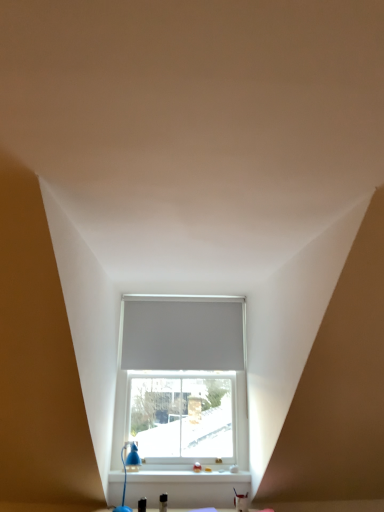
Question: Can you confirm if white matte window at center is wider than white plastic window sill at lower center?

Choices:
 (A) yes
 (B) no

Answer: (B)

Question: Does white matte window at center appear on the left side of white plastic window sill at lower center?

Choices:
 (A) no
 (B) yes

Answer: (A)

Question: Considering the relative sizes of white matte window at center and white plastic window sill at lower center in the image provided, is white matte window at center smaller than white plastic window sill at lower center?

Choices:
 (A) no
 (B) yes

Answer: (A)

Question: From a real-world perspective, is white matte window at center physically below white plastic window sill at lower center?

Choices:
 (A) yes
 (B) no

Answer: (B)

Question: Would you consider white matte window at center to be distant from white plastic window sill at lower center?

Choices:
 (A) no
 (B) yes

Answer: (A)

Question: From the image's perspective, relative to white plastic window sill at lower center, is white matte window at center above or below?

Choices:
 (A) below
 (B) above

Answer: (B)

Question: Is point (218, 442) positioned closer to the camera than point (157, 480)?

Choices:
 (A) closer
 (B) farther

Answer: (B)

Question: Relative to white plastic window sill at lower center, is white matte window at center in front or behind?

Choices:
 (A) front
 (B) behind

Answer: (B)

Question: Is white matte window at center inside the boundaries of white plastic window sill at lower center, or outside?

Choices:
 (A) inside
 (B) outside

Answer: (B)

Question: Considering their positions, is white matte blind at center located in front of or behind white matte window at center?

Choices:
 (A) behind
 (B) front

Answer: (A)

Question: Considering the positions of point (185, 303) and point (218, 332), is point (185, 303) closer or farther from the camera than point (218, 332)?

Choices:
 (A) closer
 (B) farther

Answer: (B)

Question: Considering the positions of white matte blind at center and white matte window at center in the image, is white matte blind at center taller or shorter than white matte window at center?

Choices:
 (A) short
 (B) tall

Answer: (A)

Question: Looking at their shapes, would you say white matte blind at center is wider or thinner than white matte window at center?

Choices:
 (A) wide
 (B) thin

Answer: (A)

Question: In terms of width, does white plastic window sill at lower center look wider or thinner when compared to white matte window at center?

Choices:
 (A) thin
 (B) wide

Answer: (B)

Question: Considering the positions of white plastic window sill at lower center and white matte window at center in the image, is white plastic window sill at lower center taller or shorter than white matte window at center?

Choices:
 (A) tall
 (B) short

Answer: (B)